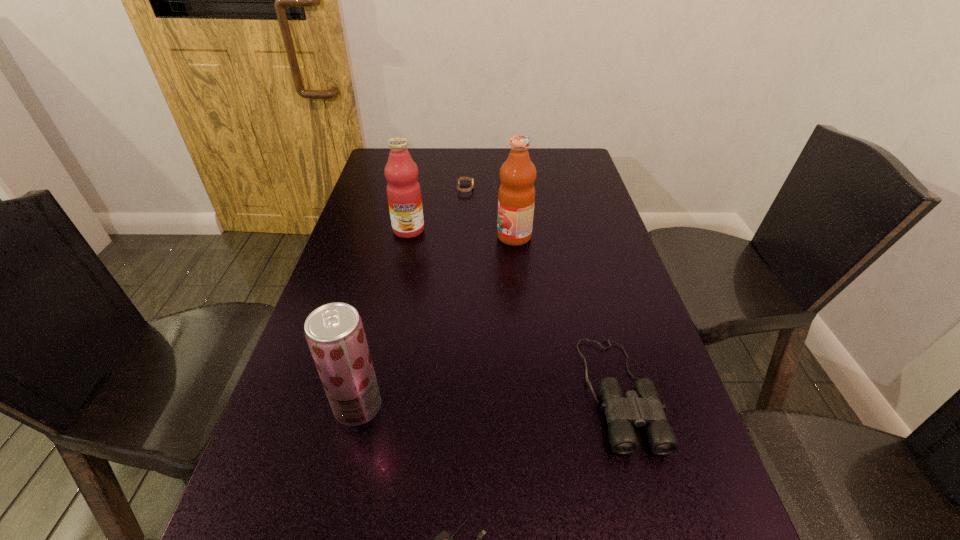
Where is `object that is the nearest to the farthest object`? Image resolution: width=960 pixels, height=540 pixels. object that is the nearest to the farthest object is located at coordinates (404, 197).

Locate an element on the screen. The width and height of the screenshot is (960, 540). fruit juice that is the second closest to the rightmost object is located at coordinates (334, 332).

Locate which fruit juice ranks third in proximity to the binoculars. Please provide its 2D coordinates. Your answer should be formatted as a tuple, i.e. [(x, y)], where the tuple contains the x and y coordinates of a point satisfying the conditions above.

[(404, 197)]

This screenshot has height=540, width=960. I want to click on free spot that satisfies the following two spatial constraints: 1. on the front label of the rightmost fruit juice; 2. on the front side of the nearest fruit juice, so click(531, 407).